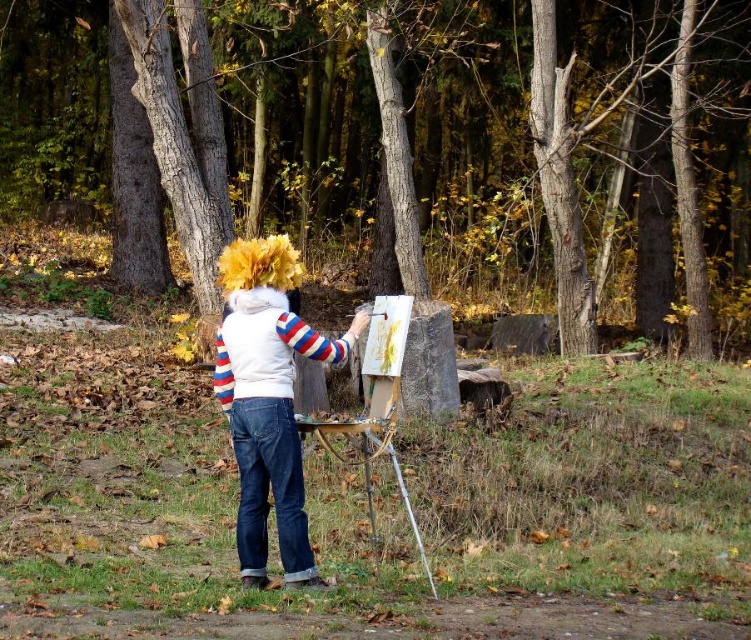
Is brown textured trunk at center above metallic silver easel at center?

Indeed, brown textured trunk at center is positioned over metallic silver easel at center.

From the picture: Between brown textured trunk at center and metallic silver easel at center, which one has less height?

Standing shorter between the two is metallic silver easel at center.

You are a GUI agent. You are given a task and a screenshot of the screen. Output one action in this format:
    pyautogui.click(x=<x>, y=<y>)
    Task: Click on the brown textured trunk at center
    Image resolution: width=751 pixels, height=640 pixels.
    Given the screenshot: What is the action you would take?
    pyautogui.click(x=451, y=148)

Does denim jacket at center appear over metallic silver easel at center?

Indeed, denim jacket at center is positioned over metallic silver easel at center.

Who is more forward, (273,316) or (391,416)?

Point (273,316)

Measure the distance between point (284, 330) and camera.

Point (284, 330) and camera are 17.29 feet apart from each other.

At what (x,y) coordinates should I click in order to perform the action: click on denim jacket at center. Please return your answer as a coordinate pair (x, y). This screenshot has height=640, width=751. Looking at the image, I should click on (267, 397).

Does brown textured trunk at center have a smaller size compared to denim jacket at center?

No, brown textured trunk at center is not smaller than denim jacket at center.

Is point (255, 228) positioned in front of point (240, 552)?

No, (255, 228) is further to viewer.

Where is `brown textured trunk at center`? The width and height of the screenshot is (751, 640). brown textured trunk at center is located at coordinates (451, 148).